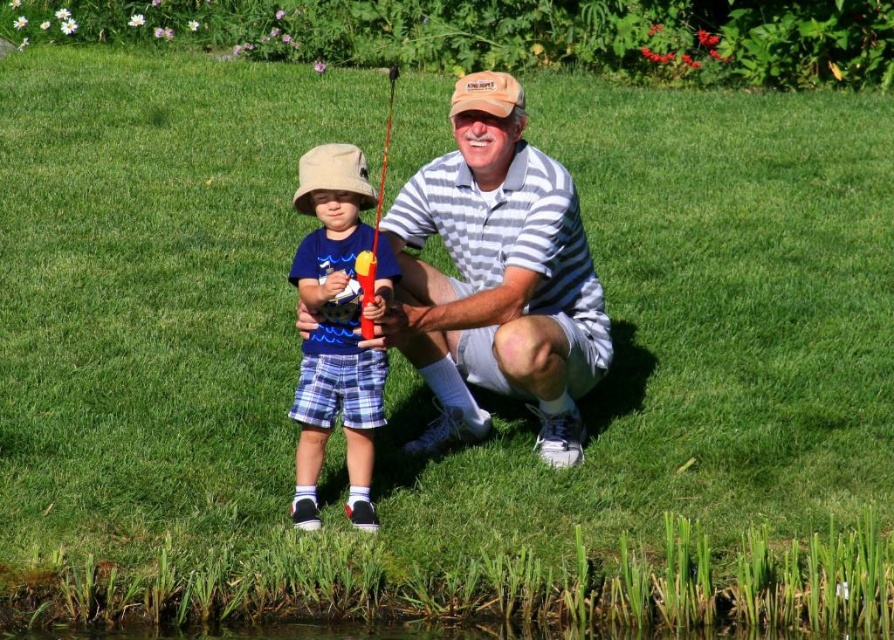
Does white striped polo shirt at center appear on the left side of blue plaid shorts at center?

Incorrect, white striped polo shirt at center is not on the left side of blue plaid shorts at center.

Is white striped polo shirt at center above blue plaid shorts at center?

Correct, white striped polo shirt at center is located above blue plaid shorts at center.

Which is behind, point (429, 220) or point (309, 372)?

Point (429, 220)

The image size is (894, 640). What are the coordinates of `white striped polo shirt at center` in the screenshot? It's located at (499, 282).

Is the position of blue plaid shorts at center less distant than that of tan fabric baseball cap at center?

Yes, it is.

Which is more to the left, blue plaid shorts at center or tan fabric baseball cap at center?

Positioned to the left is blue plaid shorts at center.

Is point (336, 339) positioned before point (504, 93)?

That is True.

Locate an element on the screen. This screenshot has height=640, width=894. blue plaid shorts at center is located at coordinates (334, 332).

Is point (523, 356) farther from camera compared to point (516, 92)?

No, (523, 356) is in front of (516, 92).

Is point (519, 228) closer to viewer compared to point (470, 86)?

No, (519, 228) is behind (470, 86).

I want to click on white striped polo shirt at center, so click(x=499, y=282).